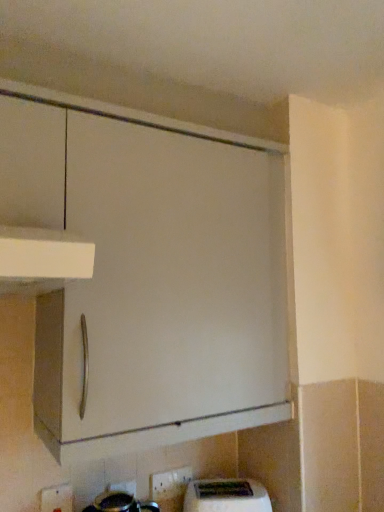
Question: In terms of size, does white plastic electric outlet at lower center, the 2th electric outlet when ordered from right to left, appear bigger or smaller than white glossy electric outlet at lower center, the first electric outlet positioned from the back?

Choices:
 (A) small
 (B) big

Answer: (B)

Question: Considering the positions of point (56, 504) and point (157, 475), is point (56, 504) closer or farther from the camera than point (157, 475)?

Choices:
 (A) closer
 (B) farther

Answer: (A)

Question: Which object is the closest to the white glossy electric outlet at lower center, the first electric outlet positioned from the back?

Choices:
 (A) white plastic electric outlet at lower center, arranged as the first electric outlet when viewed from the front
 (B) white plastic toaster at lower center

Answer: (B)

Question: Based on their relative distances, which object is farther from the white plastic electric outlet at lower center, the 2th electric outlet when ordered from right to left?

Choices:
 (A) white glossy electric outlet at lower center, the first electric outlet positioned from the back
 (B) white plastic toaster at lower center

Answer: (B)